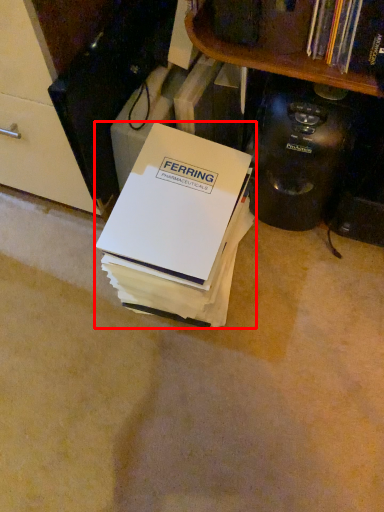
Question: In this image, where is box (annotated by the red box) located relative to appliance?

Choices:
 (A) right
 (B) left

Answer: (B)